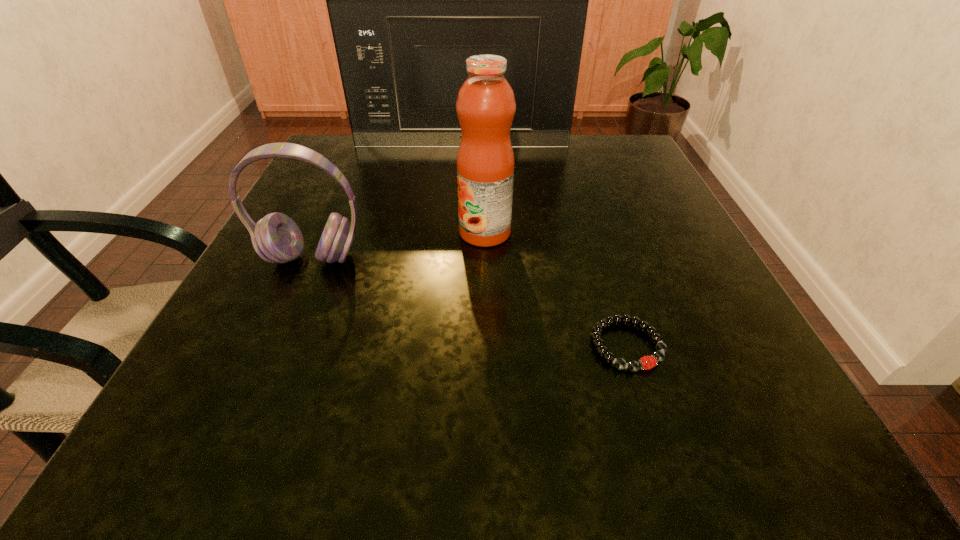
You are a GUI agent. You are given a task and a screenshot of the screen. Output one action in this format:
    pyautogui.click(x=<x>, y=<y>)
    Task: Click on the free point that satisfies the following two spatial constraints: 1. on the front label of the fruit juice; 2. on the right side of the nearest object
    This screenshot has width=960, height=540.
    Given the screenshot: What is the action you would take?
    pyautogui.click(x=487, y=346)

The image size is (960, 540). In order to click on free space that satisfies the following two spatial constraints: 1. on the headband and ear cups of the bracelet; 2. on the left side of the second shortest object in this screenshot , I will do `click(275, 346)`.

What are the coordinates of `blank space that satisfies the following two spatial constraints: 1. on the front label of the fruit juice; 2. on the headband and ear cups of the headset` in the screenshot? It's located at (485, 259).

In order to click on free space that satisfies the following two spatial constraints: 1. on the headband and ear cups of the headset; 2. on the left side of the nearest object in this screenshot , I will do `click(275, 346)`.

The width and height of the screenshot is (960, 540). I want to click on vacant space that satisfies the following two spatial constraints: 1. on the front label of the fruit juice; 2. on the left side of the shortest object, so click(x=487, y=346).

You are a GUI agent. You are given a task and a screenshot of the screen. Output one action in this format:
    pyautogui.click(x=<x>, y=<y>)
    Task: Click on the free space that satisfies the following two spatial constraints: 1. on the front label of the fruit juice; 2. on the back side of the shortest object
    This screenshot has height=540, width=960.
    Given the screenshot: What is the action you would take?
    pyautogui.click(x=487, y=346)